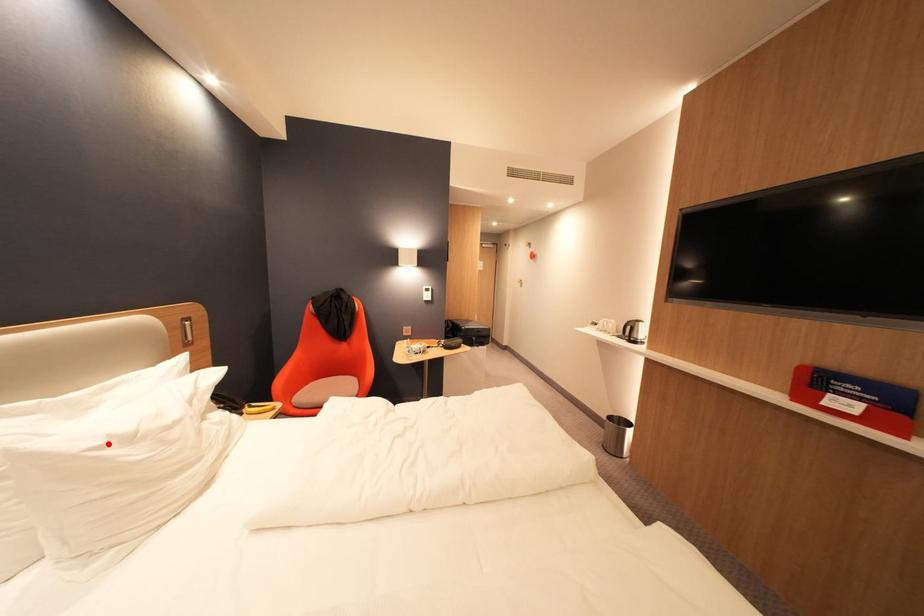
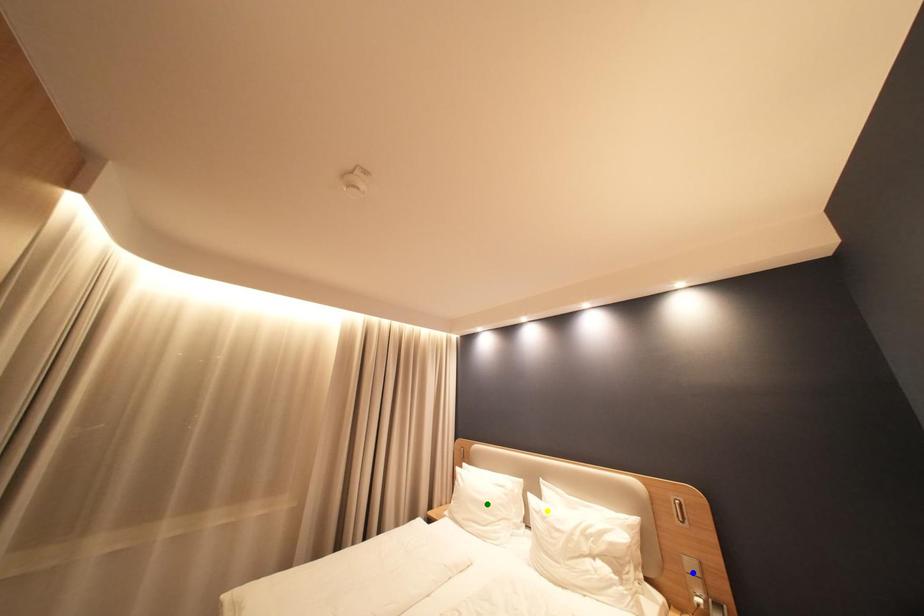
Question: I am providing you with two images of the same scene from different viewpoints. A red point is marked on the first image. You are given multiple points on the second image. Which point in image 2 represents the same 3d spot as the red point in image 1?

Choices:
 (A) yellow point
 (B) blue point
 (C) green point

Answer: (A)